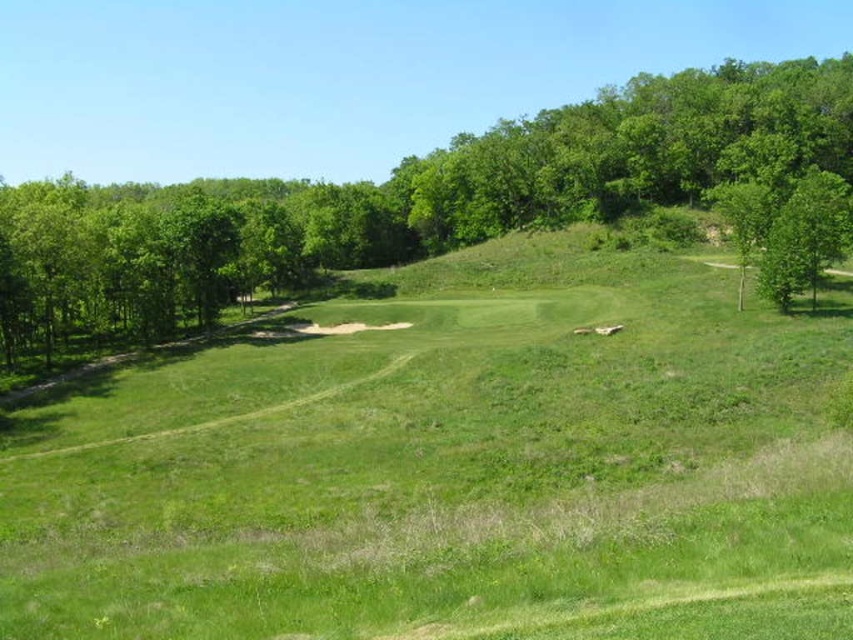
Is green grassy field at center positioned behind green leafy tree at right?

No, green grassy field at center is closer to the viewer.

Is green grassy field at center to the left of green leafy tree at right from the viewer's perspective?

Correct, you'll find green grassy field at center to the left of green leafy tree at right.

This screenshot has height=640, width=853. I want to click on green grassy field at center, so click(x=453, y=470).

At what (x,y) coordinates should I click in order to perform the action: click on green grassy field at center. Please return your answer as a coordinate pair (x, y). This screenshot has width=853, height=640. Looking at the image, I should click on (453, 470).

Is green grassy field at center shorter than green leafy tree at upper left?

Yes, green grassy field at center is shorter than green leafy tree at upper left.

Is point (474, 356) positioned behind point (270, 250)?

That is False.

At what (x,y) coordinates should I click in order to perform the action: click on green grassy field at center. Please return your answer as a coordinate pair (x, y). This screenshot has height=640, width=853. Looking at the image, I should click on (453, 470).

Is green leafy tree at upper left closer to camera compared to green leafy tree at right?

Yes.

Who is positioned more to the left, green leafy tree at upper left or green leafy tree at right?

Answer: green leafy tree at upper left

Who is more forward, (10, 342) or (822, 250)?

Point (10, 342) is more forward.

Locate an element on the screen. green leafy tree at upper left is located at coordinates (399, 202).